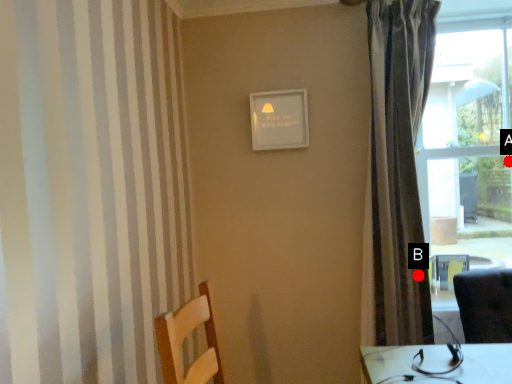
Question: Two points are circled on the image, labeled by A and B beside each circle. Which point is further to the camera?

Choices:
 (A) A is further
 (B) B is further

Answer: (A)